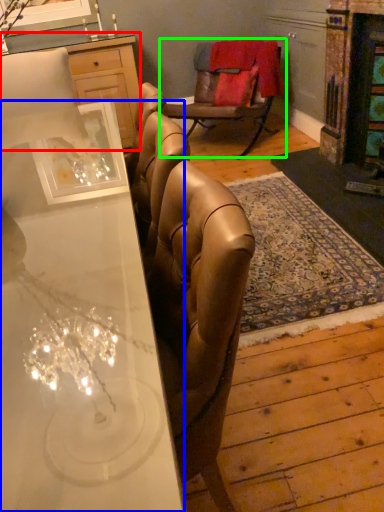
Question: Which object is positioned closest to cabinetry (highlighted by a red box)? Select from desk (highlighted by a blue box) and chair (highlighted by a green box).

Choices:
 (A) desk
 (B) chair

Answer: (B)